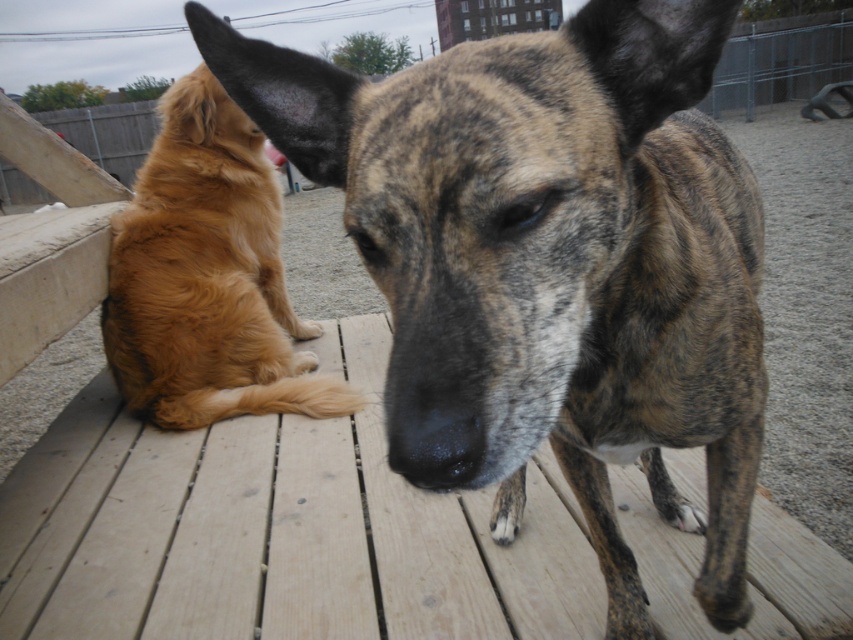
You are standing at point (448, 468) and want to walk to the other side of the park. There is an obstacle at point (209, 220). Will you have to go around it or can you walk straight ahead?

Since point (209, 220) is behind point (448, 468), you are already past the obstacle at point (209, 220). You can walk straight ahead without needing to go around it.

You are a photographer trying to capture both the brindle fur dog at center and the black smooth nose at center in a single shot. Since you want to focus on the closer subject, which one should you adjust your camera to focus on?

The brindle fur dog at center is closer to you than the black smooth nose at center, so you should focus on the brindle fur dog at center.

You are a photographer trying to capture both the brindle fur dog at center and the golden fur dog at left in a single shot. Which dog will appear larger in the photo?

The brindle fur dog at center will appear larger in the photo because it is closer to the viewer than the golden fur dog at left.